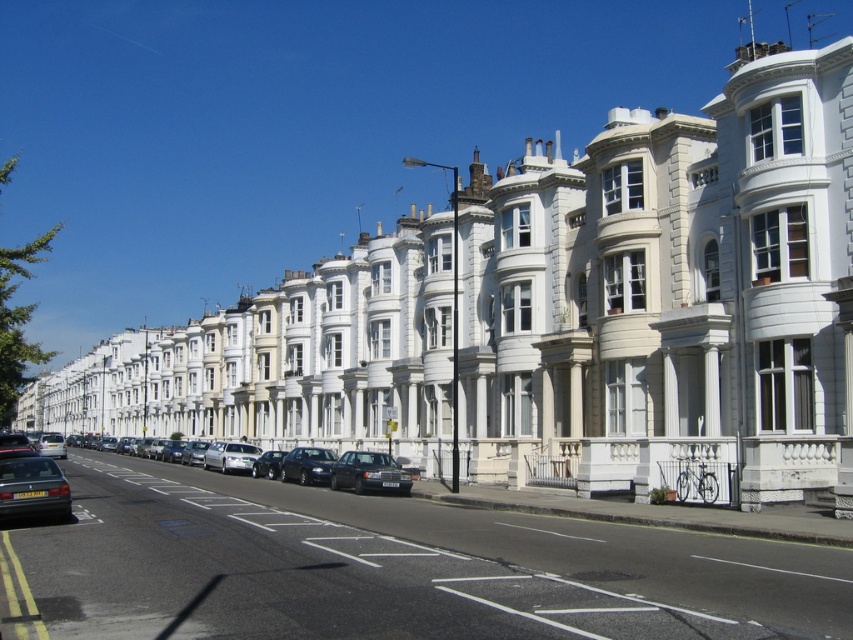
Consider the image. Is shiny silver car at center wider than silver metallic car at center-left?

Incorrect, shiny silver car at center's width does not surpass silver metallic car at center-left's.

Can you confirm if shiny silver car at center is taller than silver metallic car at center-left?

In fact, shiny silver car at center may be shorter than silver metallic car at center-left.

Who is more distant from viewer, [257,472] or [48,442]?

The point [48,442] is behind.

In order to click on shiny silver car at center in this screenshot , I will do 268,464.

Does point (33, 496) come behind point (218, 467)?

No.

In order to click on matte black car at lower left in this screenshot , I will do `click(32, 488)`.

Between shiny silver sedan at center and satin black sedan at center, which one is positioned higher?

satin black sedan at center is above.

Who is positioned more to the left, shiny silver sedan at center or satin black sedan at center?

shiny silver sedan at center

In order to click on shiny silver sedan at center in this screenshot , I will do `click(316, 467)`.